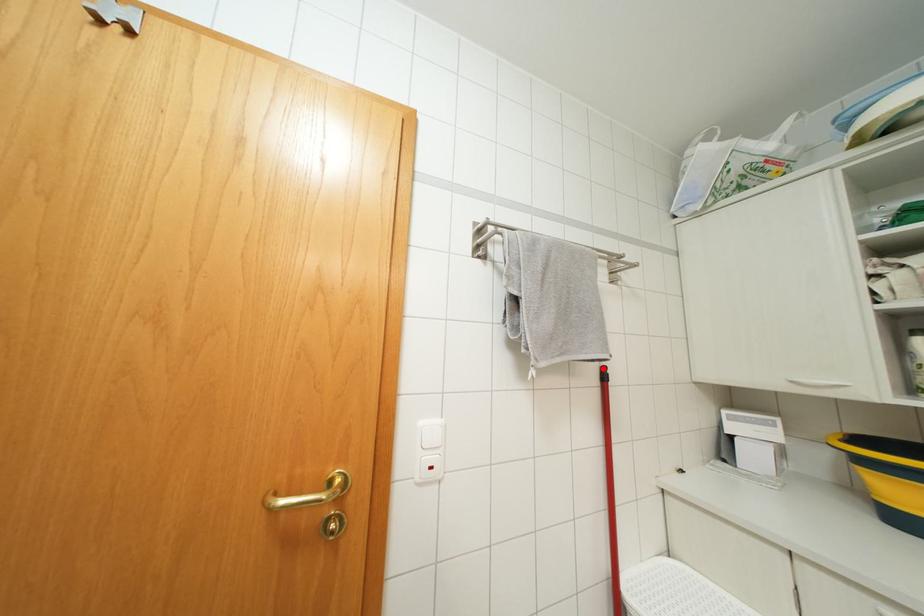
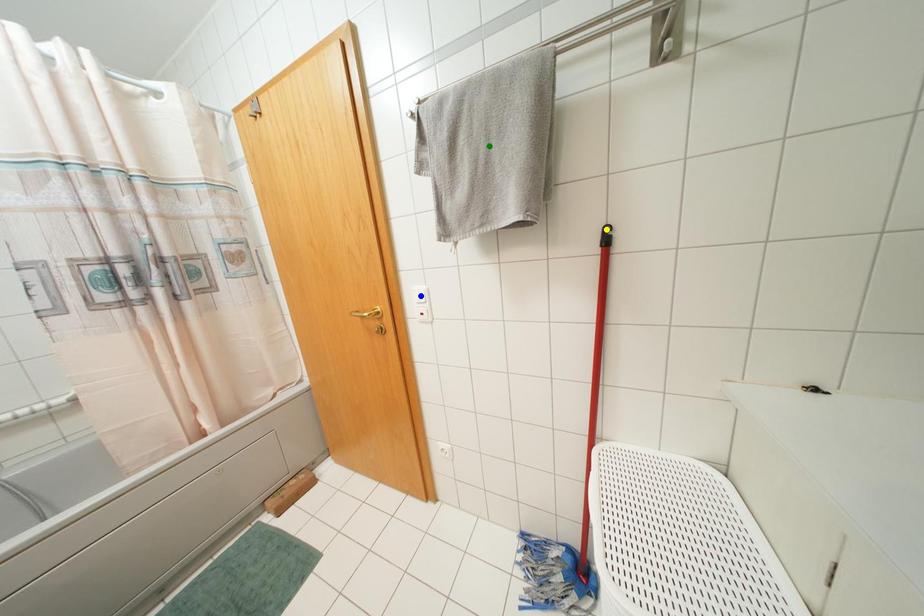
Question: I am providing you with two images of the same scene from different viewpoints. A red point is marked on the first image. You are given multiple points on the second image. Which point in image 2 represents the same 3d spot as the red point in image 1?

Choices:
 (A) green point
 (B) yellow point
 (C) blue point

Answer: (B)